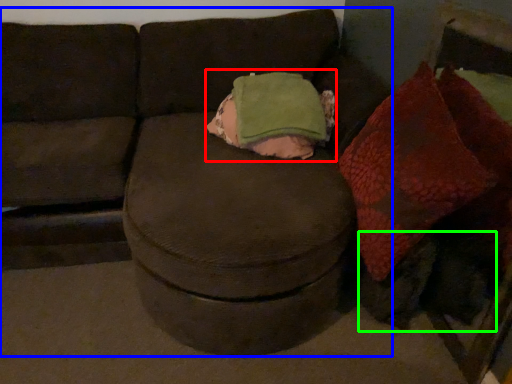
Question: Based on their relative distances, which object is nearer to throw pillow (highlighted by a red box)? Choose from studio couch (highlighted by a blue box) and animal (highlighted by a green box).

Choices:
 (A) studio couch
 (B) animal

Answer: (A)